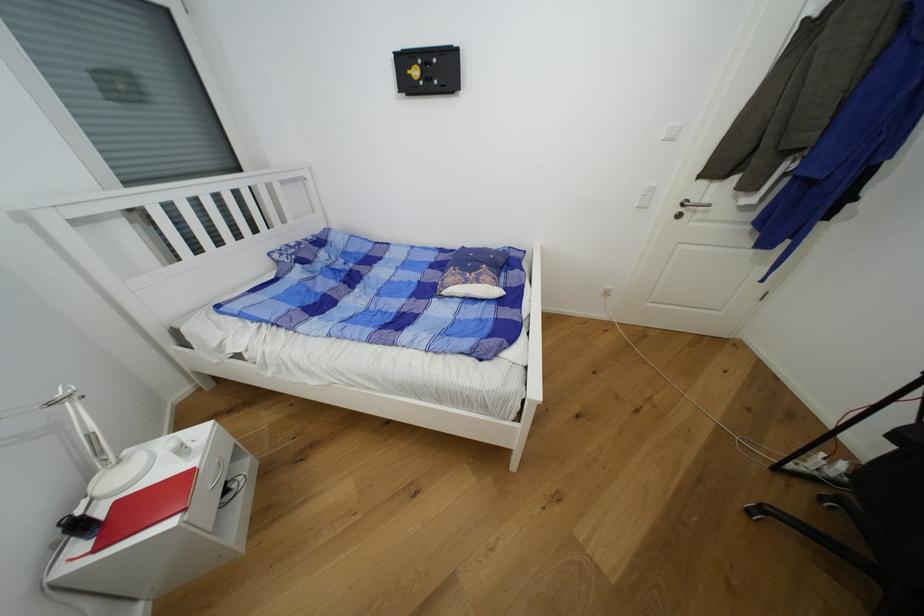
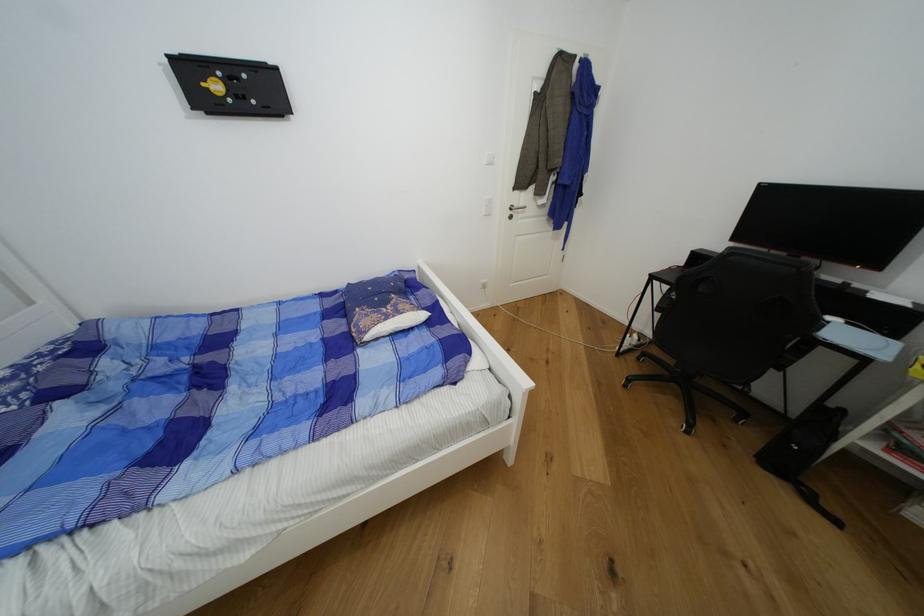
Locate, in the second image, the point that corresponds to (x=699, y=203) in the first image.

(521, 207)